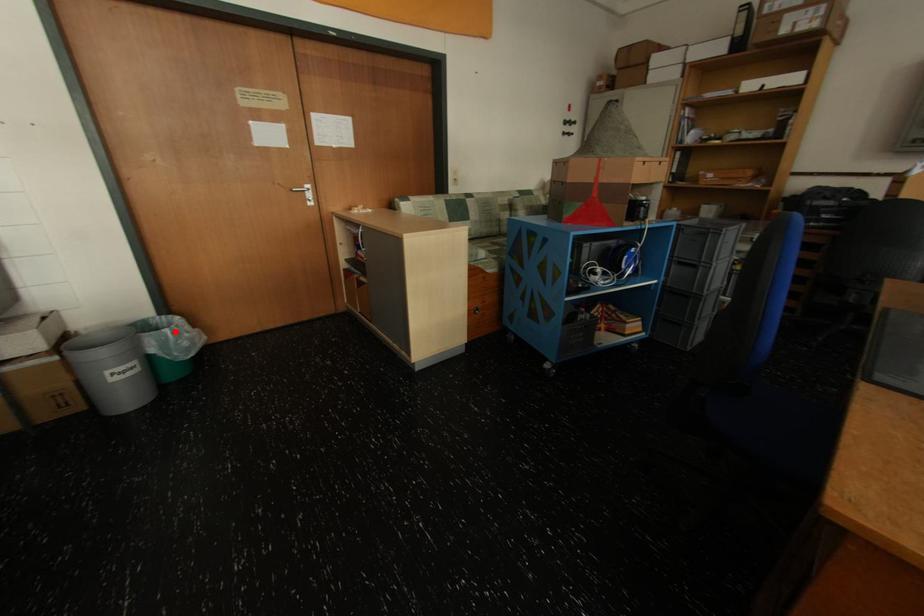
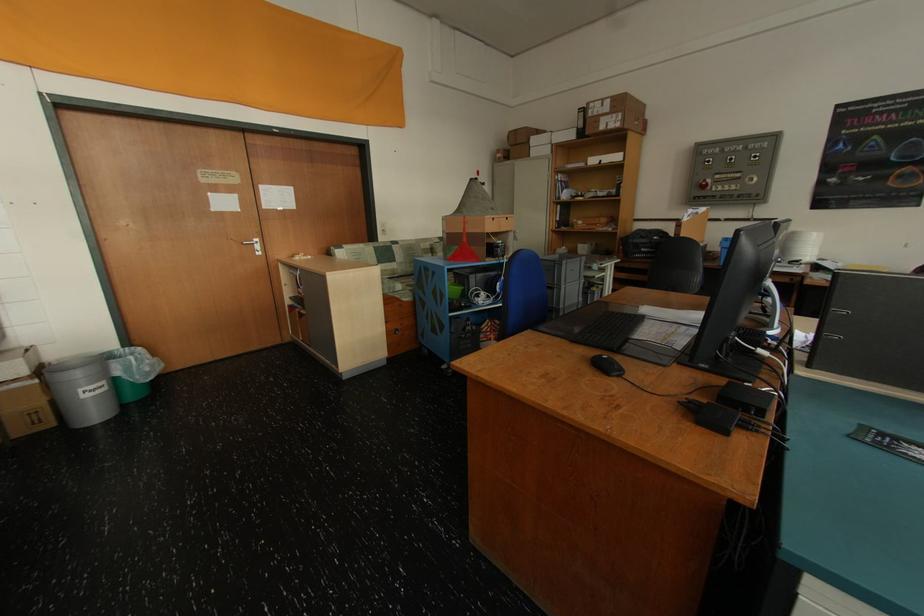
Find the pixel in the second image that matches the highlighted location in the first image.

(140, 359)